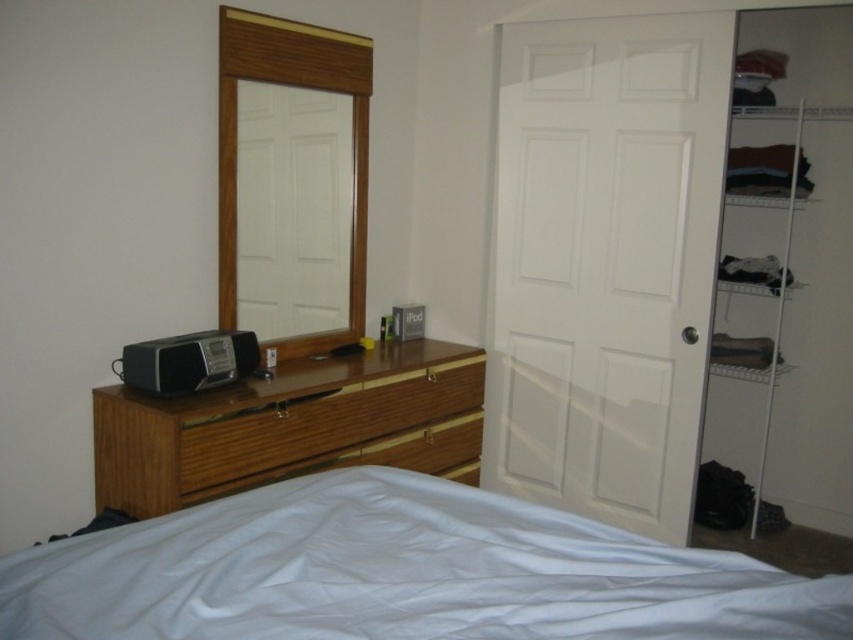
Question: Among these objects, which one is farthest from the camera?

Choices:
 (A) satin black radio at center
 (B) wooden frame at upper center
 (C) white wire shelving at right

Answer: (C)

Question: Which point is farther to the camera?

Choices:
 (A) white wire shelving at right
 (B) white smooth bedcover at lower center
 (C) wooden frame at upper center

Answer: (A)

Question: Which point is closer to the camera taking this photo?

Choices:
 (A) (190, 333)
 (B) (300, 500)
 (C) (250, 61)

Answer: (B)

Question: Is white wire shelving at right to the left of wooden frame at upper center from the viewer's perspective?

Choices:
 (A) yes
 (B) no

Answer: (B)

Question: Does white smooth bedcover at lower center have a lesser width compared to woodenmaterial/texturedresser at left?

Choices:
 (A) no
 (B) yes

Answer: (A)

Question: Is woodenmaterial/texturedresser at left below satin black radio at center?

Choices:
 (A) no
 (B) yes

Answer: (B)